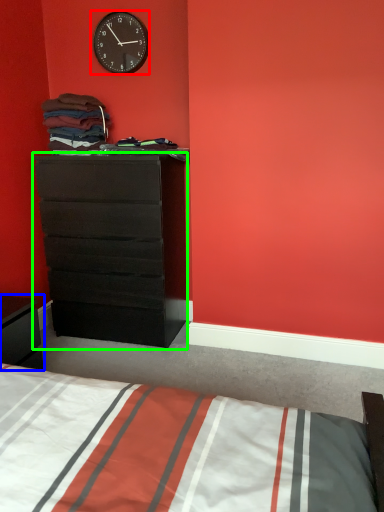
Question: Based on their relative distances, which object is nearer to wall clock (highlighted by a red box)? Choose from nightstand (highlighted by a blue box) and chest of drawers (highlighted by a green box).

Choices:
 (A) nightstand
 (B) chest of drawers

Answer: (B)